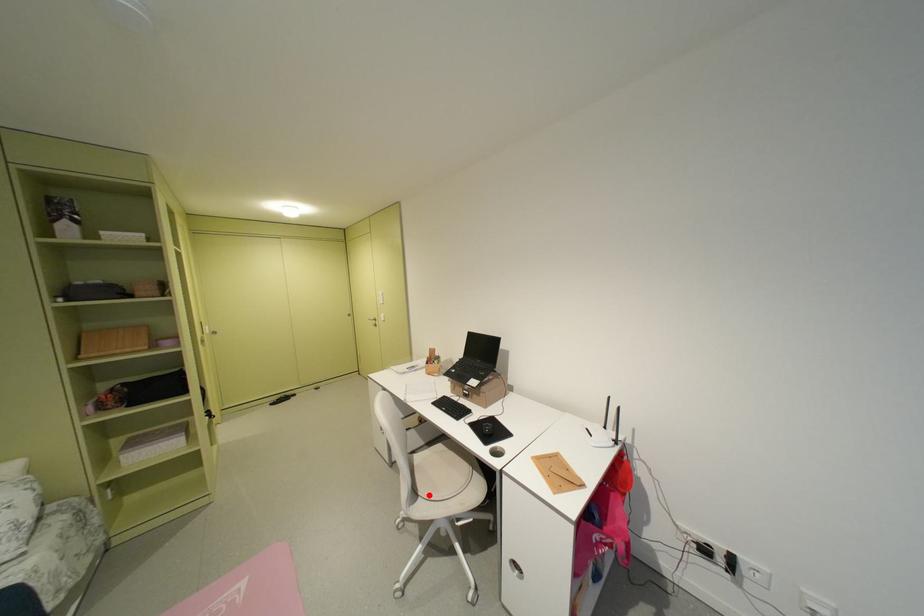
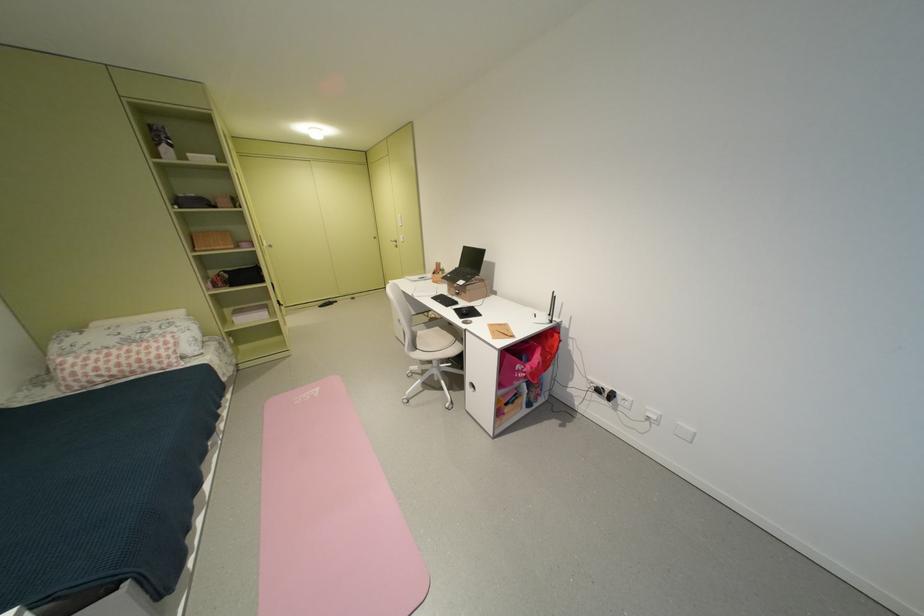
The point at the highlighted location is marked in the first image. Where is the corresponding point in the second image?

(428, 349)